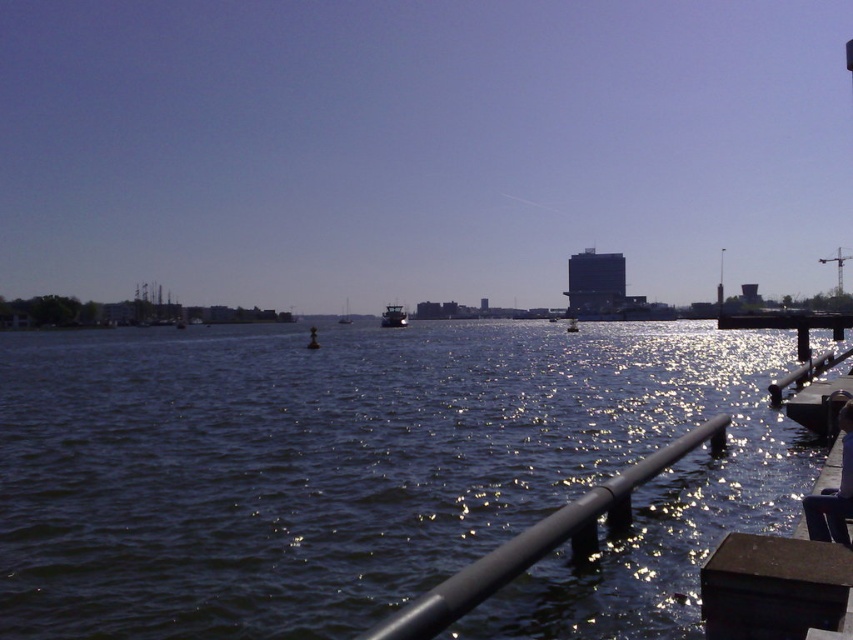
Is point (605, 484) positioned before point (569, 330)?

Yes, point (605, 484) is in front of point (569, 330).

This screenshot has width=853, height=640. Identify the location of black metal rail at lower center. (543, 540).

Is point (386, 625) less distant than point (572, 332)?

Yes, it is.

This screenshot has width=853, height=640. I want to click on black metal rail at lower center, so click(543, 540).

Based on the photo, who is positioned more to the right, black metal rail at lower center or white glossy sailboat at center?

black metal rail at lower center

This screenshot has height=640, width=853. What are the coordinates of `black metal rail at lower center` in the screenshot? It's located at (543, 540).

Can you confirm if dark blue water at center is taller than white glossy sailboat at center?

No, dark blue water at center is not taller than white glossy sailboat at center.

Between point (730, 467) and point (345, 323), which one is positioned behind?

Point (345, 323)

Image resolution: width=853 pixels, height=640 pixels. I want to click on dark blue water at center, so click(372, 474).